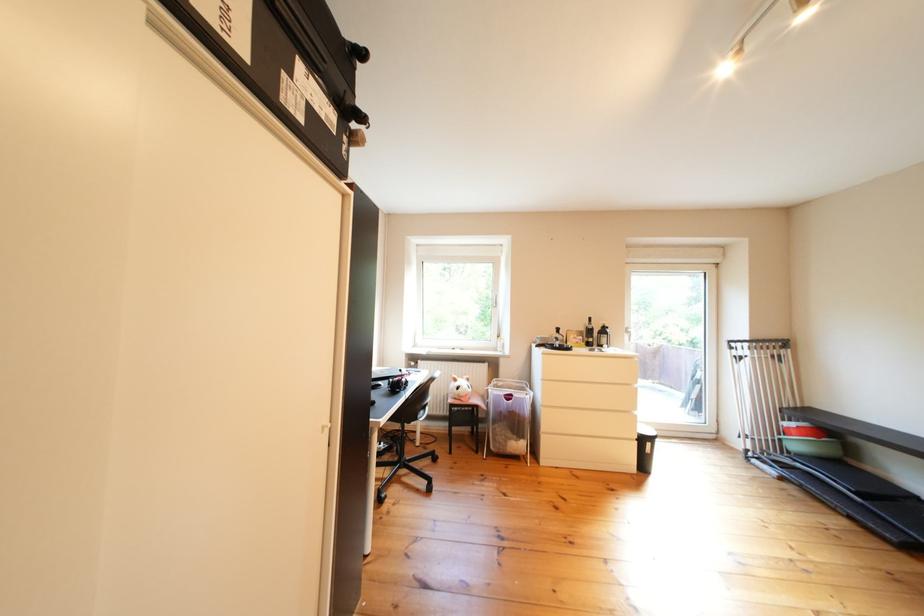
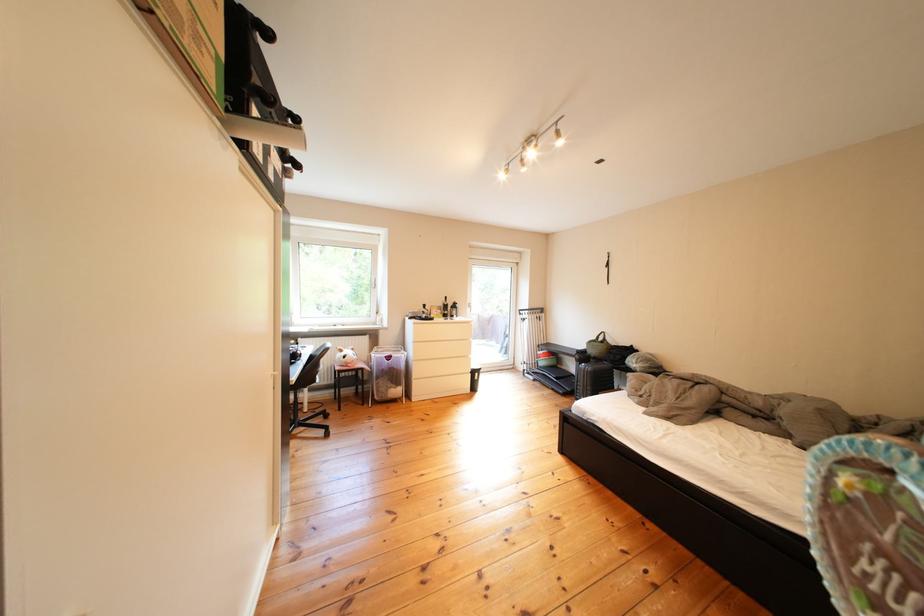
Where in the second image is the point corresponding to the point at 471,392 from the first image?

(359, 361)